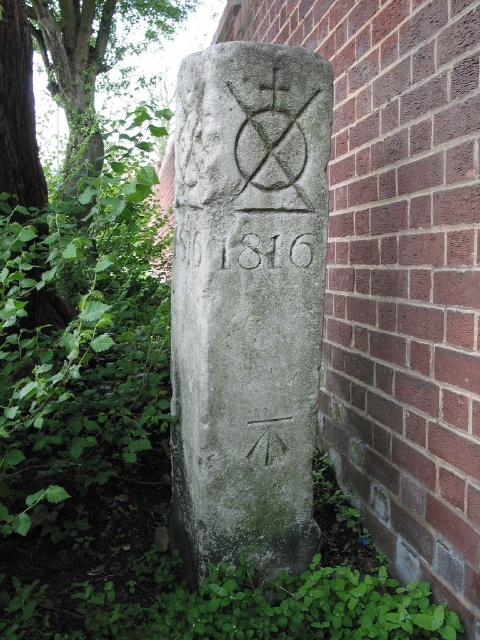
You are a botanist examining the green leafy weed at left and the gray stone inscription at center. Which object has a greater surface area?

The green leafy weed at left has a greater surface area than the gray stone inscription at center.

You are standing in a garden and see a green leafy tree at left and a gray stone inscription at center. Which object is taller?

The green leafy tree at left is much taller than the gray stone inscription at center.